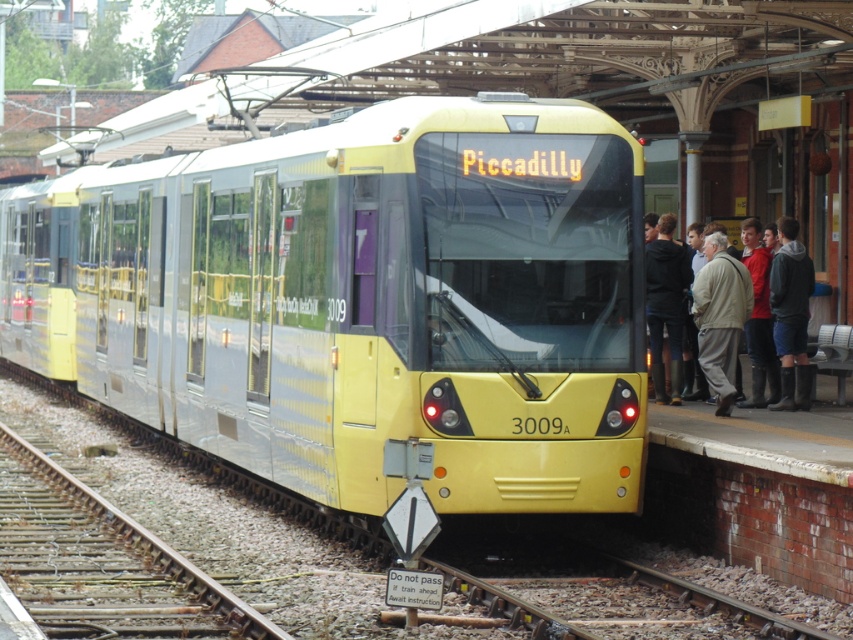
You are standing at the center of the platform. Based on the coordinates provided, where is the yellow metallic train at center located relative to your position?

The yellow metallic train at center is located at coordinates point (363, 301) relative to your position at the center of the platform.

You are a passenger waiting on the platform. You see the yellow metallic train at center and the light beige jacket at right. Which object is higher from the ground?

The yellow metallic train at center is higher from the ground than the light beige jacket at right according to the description.